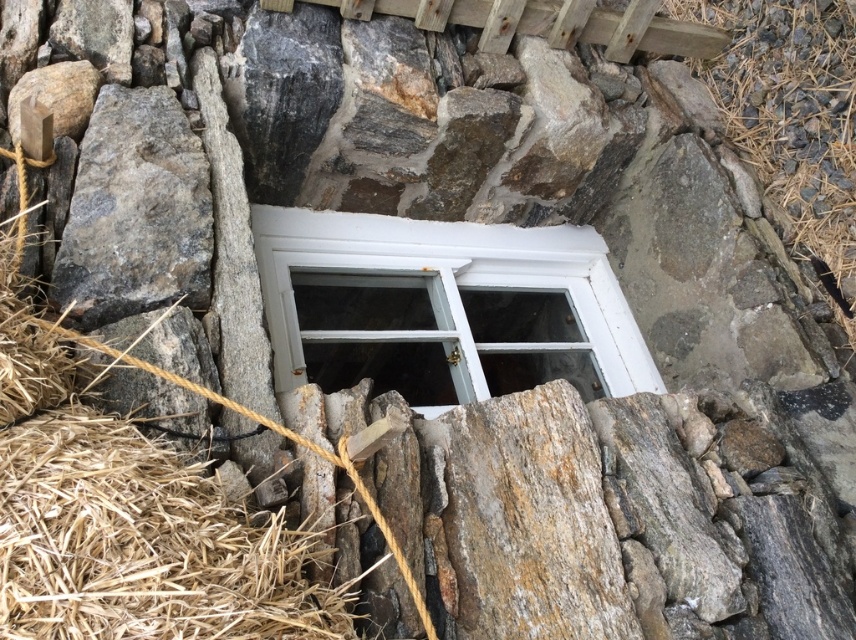
Between white painted wood window at center and gray rough stone at left, which one has less height?

With less height is gray rough stone at left.

Is white painted wood window at center wider than gray rough stone at left?

Correct, the width of white painted wood window at center exceeds that of gray rough stone at left.

This screenshot has height=640, width=856. In order to click on white painted wood window at center in this screenshot , I will do `click(450, 285)`.

Between brown straw at lower left and gray rough stone at left, which one appears on the left side from the viewer's perspective?

Positioned to the left is gray rough stone at left.

Who is lower down, brown straw at lower left or gray rough stone at left?

brown straw at lower left is below.

Where is `brown straw at lower left`? brown straw at lower left is located at coordinates 123,516.

Is brown straw at lower left further to camera compared to white painted wood window at center?

No, it is not.

Between brown straw at lower left and white painted wood window at center, which one is positioned higher?

Positioned higher is white painted wood window at center.

Is point (250, 620) positioned behind point (456, 321)?

That is False.

Locate an element on the screen. brown straw at lower left is located at coordinates (123, 516).